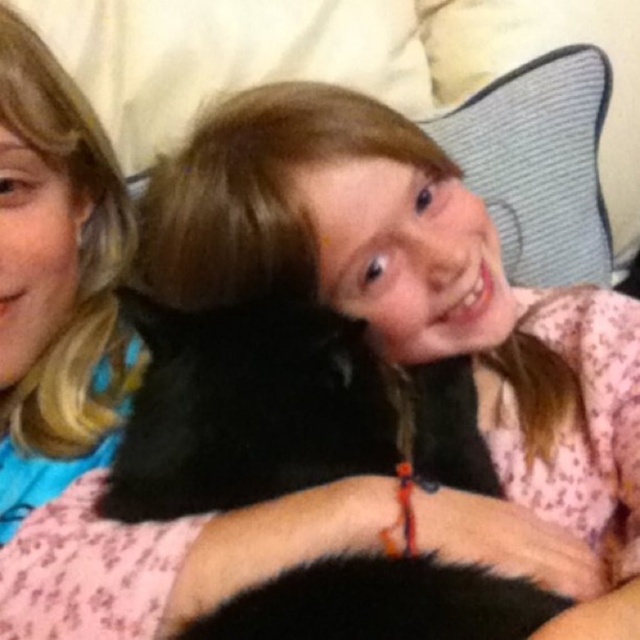
You are a photographer trying to capture a candid shot of the two children in the scene. You want to focus on the point at coordinates point (212, 419). If your camera has a depth of field that can clearly capture objects within 25 inches from the camera, will the point be in focus?

The point (212, 419) is 24.82 inches away from the camera, so it will be within the depth of field and in focus.

In the scene where two children are lying down, there is a point marked at coordinates (280,410). What object is located at this point?

The point at coordinates (280,410) marks the location of the black fluffy cat at center.

You are a photographer trying to capture a closeup shot of the black fluffy cat at center. The camera you are using has a minimum focusing distance of 50 centimeters. Based on the scene, will you be able to take the photo without moving closer?

The black fluffy cat at center is 49.19 centimeters away from the camera. Since the minimum focusing distance is 50 centimeters, the camera cannot focus at distances closer than that. Therefore, you cannot take the photo without moving further back to ensure the cat is at least 50 centimeters away.